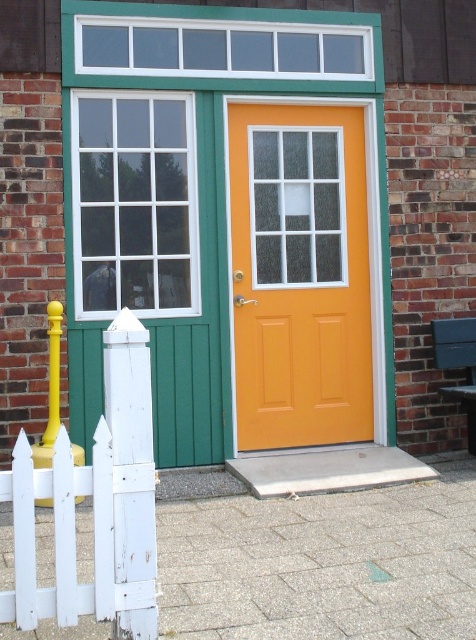
You are standing in front of the entrance and want to walk to the orange matte door at center. Which direction should you move relative to the white wooden picket fence at left?

Since the orange matte door at center is to the right of the white wooden picket fence at left, you should move to the right of the white wooden picket fence at left to reach the orange matte door at center.

You are a painter who needs to decide which object to paint first. The orange matte door at center and the white wooden picket fence at left are both in your current view. Since you want to paint the wider object first, which one should you choose?

The orange matte door at center is wider than the white wooden picket fence at left, so you should paint the orange matte door at center first.